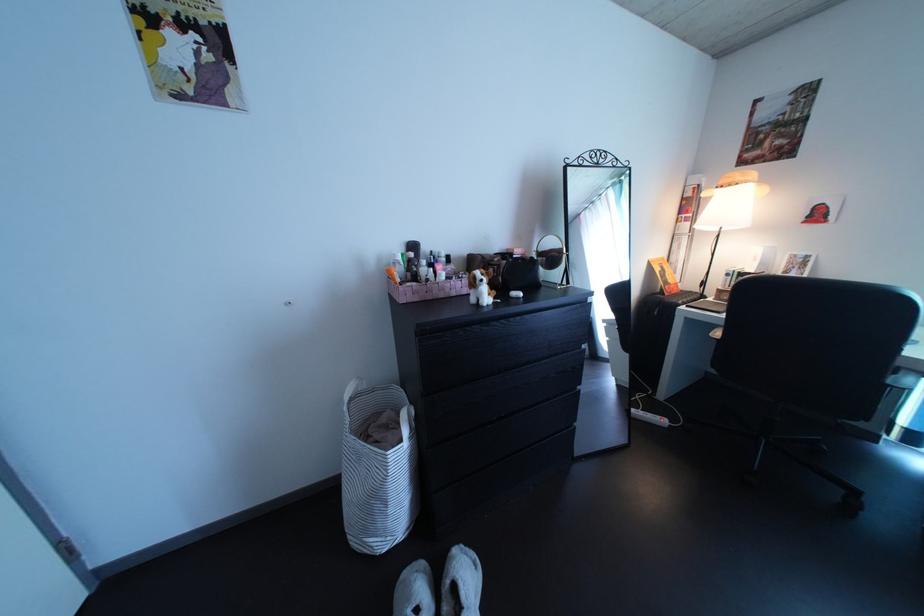
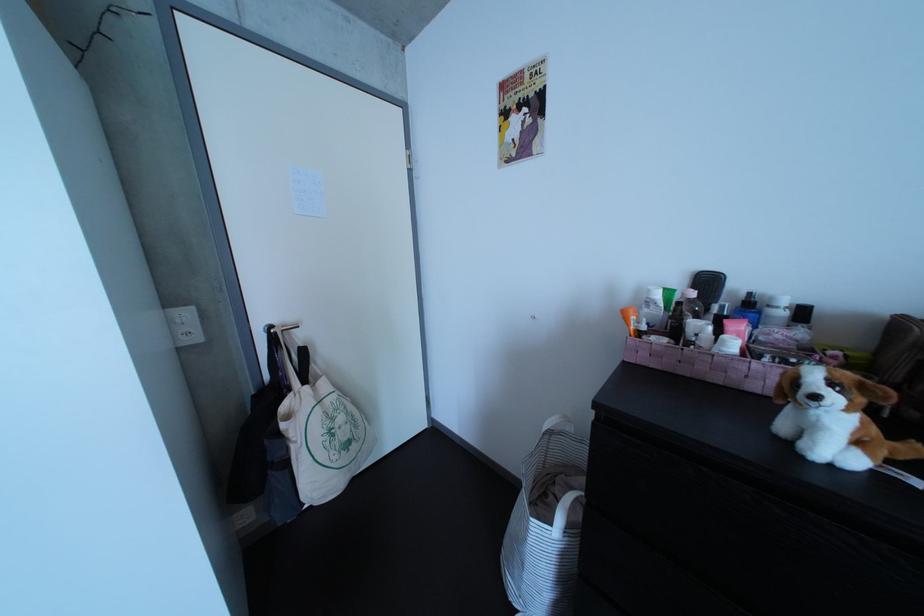
The point at [464,286] is marked in the first image. Where is the corresponding point in the second image?

(764, 362)